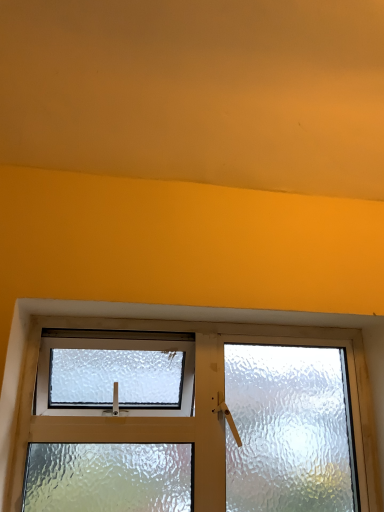
Question: Should I look upward or downward to see clear glass door at bottom?

Choices:
 (A) down
 (B) up

Answer: (A)